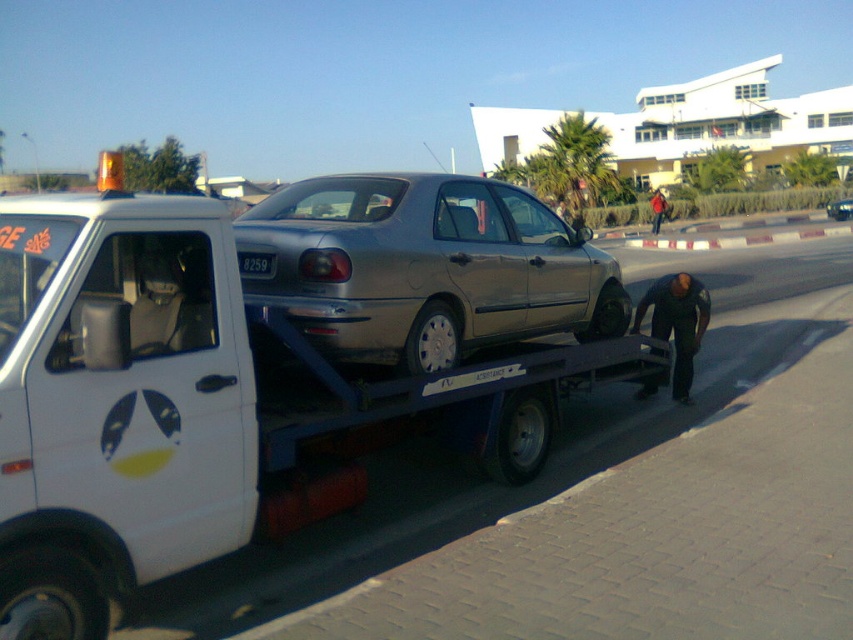
Question: Which point is closer to the camera taking this photo?

Choices:
 (A) (242, 272)
 (B) (677, 337)

Answer: (A)

Question: Does dark brown leather jacket at lower right appear over black plastic license plate at center?

Choices:
 (A) yes
 (B) no

Answer: (B)

Question: Does satin silver car at center appear on the right side of black plastic license plate at center?

Choices:
 (A) no
 (B) yes

Answer: (B)

Question: Which of these objects is positioned farthest from the satin silver car at center?

Choices:
 (A) white matte tow truck at center
 (B) black plastic license plate at center

Answer: (B)

Question: Does dark brown leather jacket at lower right appear on the right side of black plastic license plate at center?

Choices:
 (A) yes
 (B) no

Answer: (A)

Question: Which point is farther to the camera?

Choices:
 (A) (674, 298)
 (B) (201, 284)
 (C) (257, 262)

Answer: (A)